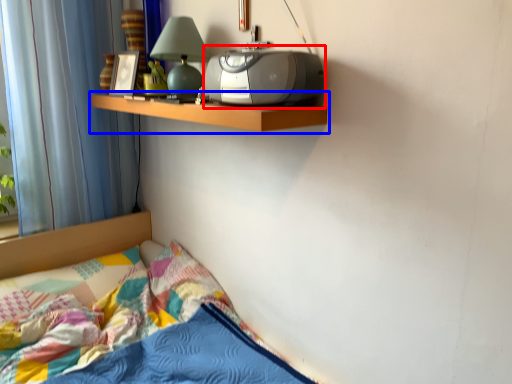
Question: Among these objects, which one is nearest to the camera, stereo (highlighted by a red box) or shelf (highlighted by a blue box)?

Choices:
 (A) stereo
 (B) shelf

Answer: (A)